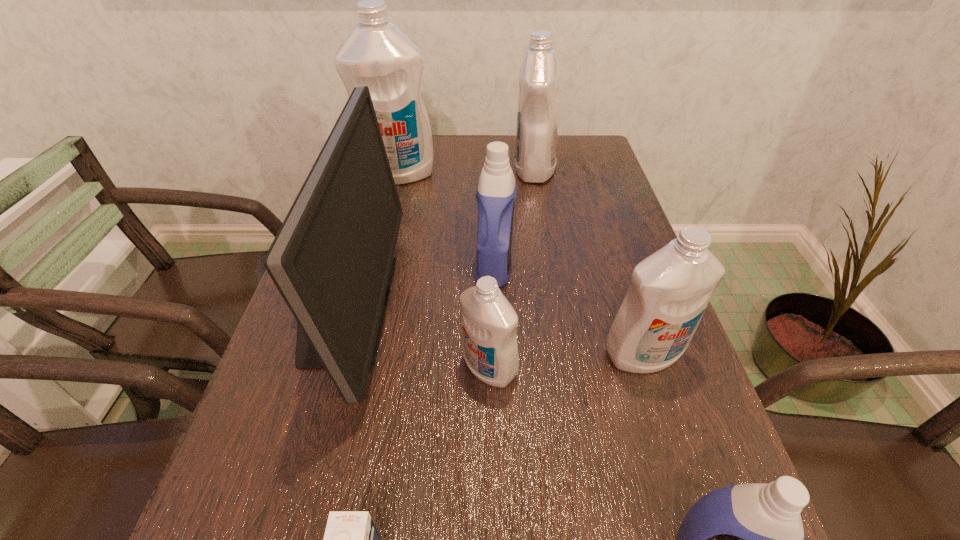
At what (x,y) coordinates should I click in order to perform the action: click on white detergent that can be found as the closest to the rightmost white detergent. Please return your answer as a coordinate pair (x, y). The width and height of the screenshot is (960, 540). Looking at the image, I should click on (489, 322).

Identify the location of free spot that satisfies the following two spatial constraints: 1. on the front side of the tallest object; 2. on the left side of the fourth nearest detergent. (374, 266).